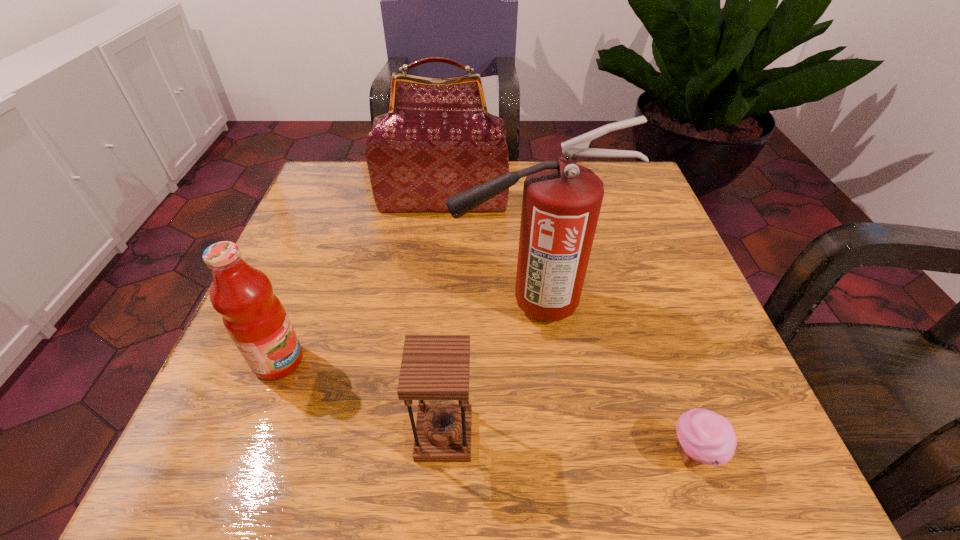
Identify the location of vacant space located 0.120m on the front-facing side of the handbag. The image size is (960, 540). (439, 248).

The height and width of the screenshot is (540, 960). What are the coordinates of `blank space located on the front label of the fruit juice` in the screenshot? It's located at (524, 361).

At what (x,y) coordinates should I click in order to perform the action: click on vacant space located 0.320m on the right of the second shortest object. Please return your answer as a coordinate pair (x, y). Looking at the image, I should click on (689, 435).

Where is `free space located 0.390m on the back of the shortest object`? free space located 0.390m on the back of the shortest object is located at coordinates (624, 253).

Where is `object present at the far edge`? object present at the far edge is located at coordinates (438, 140).

Locate an element on the screen. The height and width of the screenshot is (540, 960). hourglass present at the near edge is located at coordinates point(434,369).

This screenshot has height=540, width=960. Find the location of `cupcake located at the near edge`. cupcake located at the near edge is located at coordinates (703, 437).

Locate an element on the screen. This screenshot has height=540, width=960. object that is at the left edge is located at coordinates (254, 317).

Locate an element on the screen. object present at the right edge is located at coordinates (703, 437).

Locate an element on the screen. Image resolution: width=960 pixels, height=540 pixels. object that is positioned at the near right corner is located at coordinates (703, 437).